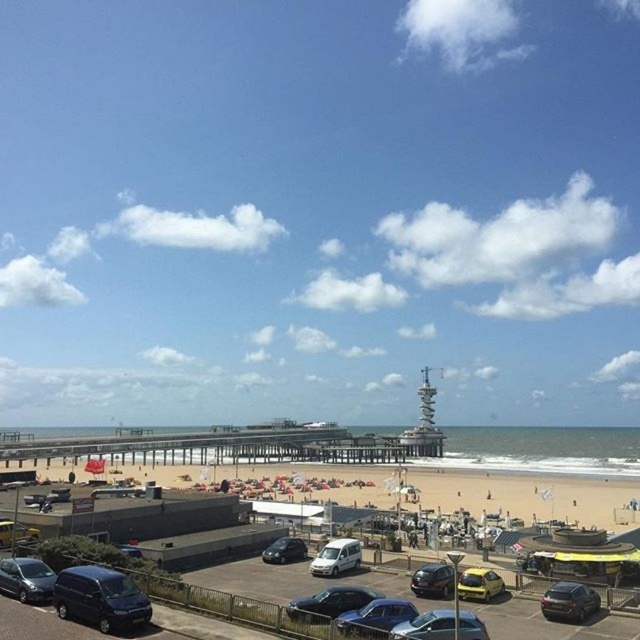
Between shiny black car at lower center and metallic silver van at lower left, which one has less height?

metallic silver van at lower left

Who is positioned more to the right, shiny black car at lower center or metallic silver van at lower left?

From the viewer's perspective, shiny black car at lower center appears more on the right side.

Who is more distant from viewer, [432,573] or [8,525]?

The point [8,525] is behind.

Find the location of a particular element. The width and height of the screenshot is (640, 640). shiny black car at lower center is located at coordinates (433, 580).

Is shiny black van at lower left to the left of white matte van at center from the viewer's perspective?

Indeed, shiny black van at lower left is positioned on the left side of white matte van at center.

Which is more to the left, shiny black van at lower left or white matte van at center?

shiny black van at lower left

The height and width of the screenshot is (640, 640). In order to click on shiny black van at lower left in this screenshot , I will do `click(100, 598)`.

Who is more distant from viewer, (x=10, y=513) or (x=596, y=596)?

The point (x=10, y=513) is behind.

Who is higher up, black matte parking lot at lower center or shiny black sedan at lower right?

shiny black sedan at lower right

Identify the location of black matte parking lot at lower center. (300, 579).

You are a GUI agent. You are given a task and a screenshot of the screen. Output one action in this format:
    pyautogui.click(x=<x>, y=<y>)
    Task: Click on the black matte parking lot at lower center
    The width and height of the screenshot is (640, 640).
    Given the screenshot: What is the action you would take?
    pyautogui.click(x=300, y=579)